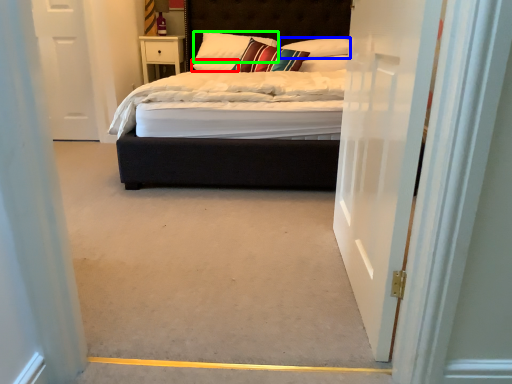
Question: Estimate the real-world distances between objects in this image. Which object is closer to pillow (highlighted by a red box), pillow (highlighted by a blue box) or pillow (highlighted by a green box)?

Choices:
 (A) pillow
 (B) pillow

Answer: (B)